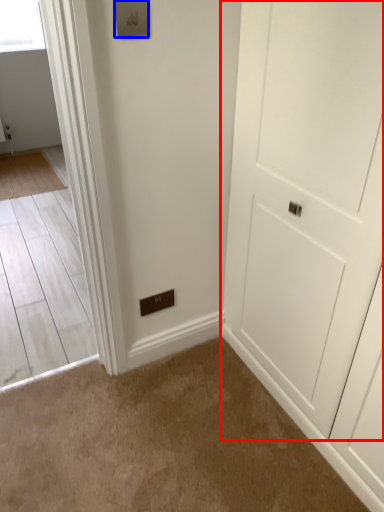
Question: Which object is closer to the camera taking this photo, door (highlighted by a red box) or light switch (highlighted by a blue box)?

Choices:
 (A) door
 (B) light switch

Answer: (A)